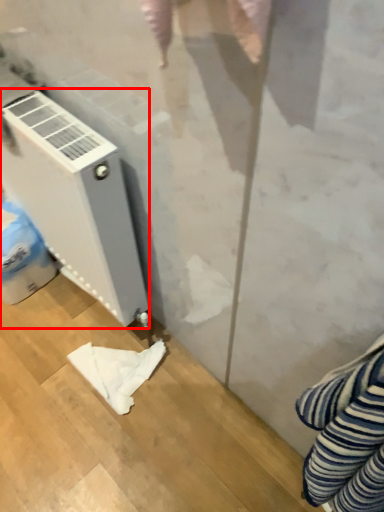
Question: From the image, what is the correct spatial relationship of home appliance (annotated by the red box) in relation to cloth?

Choices:
 (A) right
 (B) left

Answer: (B)